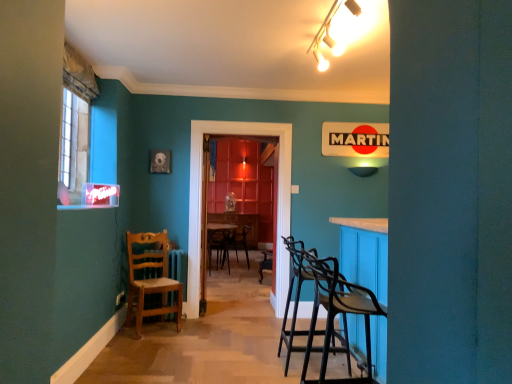
This screenshot has height=384, width=512. What do you see at coordinates (201, 202) in the screenshot?
I see `translucent wooden door at center` at bounding box center [201, 202].

Image resolution: width=512 pixels, height=384 pixels. Find the location of `translucent wooden door at center`. translucent wooden door at center is located at coordinates (201, 202).

I want to click on matte white lampshade at upper right, so click(x=362, y=171).

Image resolution: width=512 pixels, height=384 pixels. What do you see at coordinates (329, 33) in the screenshot? I see `white glossy track light at upper center` at bounding box center [329, 33].

What do you see at coordinates (120, 298) in the screenshot? I see `matte plastic power outlet at lower left` at bounding box center [120, 298].

What is the approximate height of wooden chair at left?

The height of wooden chair at left is 38.00 inches.

The width and height of the screenshot is (512, 384). In order to click on translucent wooden door at center in this screenshot , I will do `click(201, 202)`.

Which is nearer, (173, 308) or (329, 38)?

Clearly, point (173, 308) is more distant from the camera than point (329, 38).

From a real-world perspective, is wooden chair at left positioned over white glossy track light at upper center based on gravity?

No.

Where is `chair behind the white glossy track light at upper center`? This screenshot has width=512, height=384. chair behind the white glossy track light at upper center is located at coordinates [x=150, y=278].

Is wooden chair at left positioned beyond the bounds of white glossy track light at upper center?

Yes, wooden chair at left is located beyond the bounds of white glossy track light at upper center.

Considering the relative sizes of wooden chair at left and matte plastic power outlet at lower left in the image provided, is wooden chair at left wider than matte plastic power outlet at lower left?

Indeed, wooden chair at left has a greater width compared to matte plastic power outlet at lower left.

From a real-world perspective, who is located lower, wooden chair at left or matte plastic power outlet at lower left?

In real-world perspective, matte plastic power outlet at lower left is lower.

The height and width of the screenshot is (384, 512). I want to click on power outlet located underneath the wooden chair at left (from a real-world perspective), so click(x=120, y=298).

Is there a large distance between wooden chair at left and matte plastic power outlet at lower left?

No.

Consider the image. Considering the sizes of objects matte plastic power outlet at lower left and translucent wooden door at center in the image provided, who is thinner, matte plastic power outlet at lower left or translucent wooden door at center?

matte plastic power outlet at lower left is thinner.

From the image's perspective, which is above, matte plastic power outlet at lower left or translucent wooden door at center?

translucent wooden door at center is shown above in the image.

Is translucent wooden door at center a part of matte plastic power outlet at lower left?

No, matte plastic power outlet at lower left does not contain translucent wooden door at center.

Considering the sizes of matte plastic power outlet at lower left and translucent wooden door at center in the image, is matte plastic power outlet at lower left taller or shorter than translucent wooden door at center?

Considering their sizes, matte plastic power outlet at lower left has less height than translucent wooden door at center.

Does wooden chair at left have a lesser height compared to matte white lampshade at upper right?

In fact, wooden chair at left may be taller than matte white lampshade at upper right.

From the picture: Is wooden chair at left surrounding matte white lampshade at upper right?

No.

Is wooden chair at left facing towards matte white lampshade at upper right?

No, wooden chair at left does not turn towards matte white lampshade at upper right.

From the image's perspective, relative to matte white lampshade at upper right, is wooden chair at left above or below?

Based on their image positions, wooden chair at left is located beneath matte white lampshade at upper right.

Would you say white glossy track light at upper center is outside translucent wooden door at center?

Yes, white glossy track light at upper center is not within translucent wooden door at center.

Is point (325, 22) positioned before point (284, 128)?

Yes, point (325, 22) is in front of point (284, 128).

You are a GUI agent. You are given a task and a screenshot of the screen. Output one action in this format:
    pyautogui.click(x=<x>, y=<y>)
    Task: Click on the glass door that is behind the white glossy track light at upper center
    This screenshot has height=384, width=512.
    Given the screenshot: What is the action you would take?
    pyautogui.click(x=201, y=202)

Does point (156, 288) come farther from viewer compared to point (159, 160)?

That is False.

Is wooden chair at left beside wooden picture frame at upper left?

No, wooden chair at left is not beside wooden picture frame at upper left.

From the image's perspective, is wooden picture frame at upper left located beneath matte plastic power outlet at lower left?

Incorrect, from the image's perspective, wooden picture frame at upper left is higher than matte plastic power outlet at lower left.

Locate an element on the screen. picture frame above the matte plastic power outlet at lower left (from a real-world perspective) is located at coordinates (160, 161).

Is wooden picture frame at upper left to the left of matte plastic power outlet at lower left from the viewer's perspective?

Incorrect, wooden picture frame at upper left is not on the left side of matte plastic power outlet at lower left.

Find the location of `lamp above the wooden chair at left (from a real-world perspective)`. lamp above the wooden chair at left (from a real-world perspective) is located at coordinates (329, 33).

Locate an element on the screen. The height and width of the screenshot is (384, 512). power outlet below the wooden chair at left (from a real-world perspective) is located at coordinates (120, 298).

Considering their positions, is wooden picture frame at upper left positioned further to matte plastic power outlet at lower left than white glossy track light at upper center?

Based on the image, white glossy track light at upper center appears to be further to matte plastic power outlet at lower left.

From the image, which object appears to be nearer to translucent wooden door at center, wooden picture frame at upper left or wooden chair at left?

Among the two, wooden chair at left is located nearer to translucent wooden door at center.

Looking at the image, which one is located closer to matte white lampshade at upper right, white glossy track light at upper center or wooden picture frame at upper left?

The object closer to matte white lampshade at upper right is white glossy track light at upper center.

When comparing their distances from wooden chair at left, does translucent wooden door at center or matte plastic power outlet at lower left seem closer?

matte plastic power outlet at lower left is positioned closer to the anchor wooden chair at left.

Which object lies further to the anchor point wooden chair at left, white glossy track light at upper center or matte white lampshade at upper right?

The object further to wooden chair at left is white glossy track light at upper center.

When comparing their distances from matte white lampshade at upper right, does white glossy track light at upper center or matte plastic power outlet at lower left seem closer?

Among the two, white glossy track light at upper center is located nearer to matte white lampshade at upper right.

Looking at the image, which one is located further to white glossy track light at upper center, matte white lampshade at upper right or matte plastic power outlet at lower left?

The object further to white glossy track light at upper center is matte plastic power outlet at lower left.

Which object lies nearer to the anchor point matte plastic power outlet at lower left, matte white lampshade at upper right or translucent wooden door at center?

translucent wooden door at center.

Locate an element on the screen. Image resolution: width=512 pixels, height=384 pixels. chair between white glossy track light at upper center and matte plastic power outlet at lower left in the vertical direction is located at coordinates tap(150, 278).

Find the location of a particular element. The image size is (512, 384). chair between white glossy track light at upper center and wooden picture frame at upper left along the z-axis is located at coordinates (150, 278).

This screenshot has width=512, height=384. In order to click on chair situated between wooden picture frame at upper left and matte white lampshade at upper right from left to right in this screenshot , I will do `click(150, 278)`.

The height and width of the screenshot is (384, 512). I want to click on chair between white glossy track light at upper center and matte white lampshade at upper right in the front-back direction, so click(150, 278).